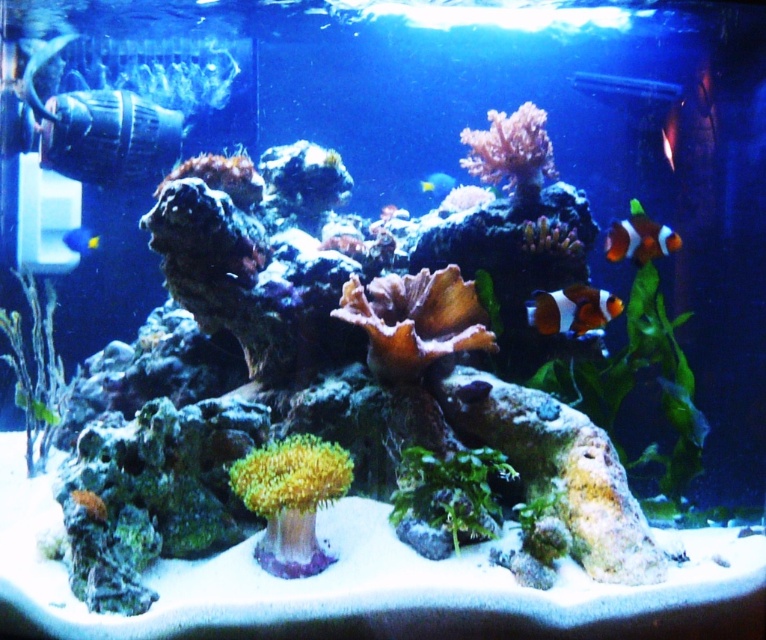
Does orange and white striped fish at upper right appear over translucent yellow fish at center?

Incorrect, orange and white striped fish at upper right is not positioned above translucent yellow fish at center.

Who is more distant from viewer, (x=630, y=246) or (x=434, y=182)?

The point (x=434, y=182) is behind.

Locate an element on the screen. This screenshot has width=766, height=640. orange and white striped fish at upper right is located at coordinates (640, 240).

At what (x,y) coordinates should I click in order to perform the action: click on orange and white striped fish at upper right. Please return your answer as a coordinate pair (x, y). Image resolution: width=766 pixels, height=640 pixels. Looking at the image, I should click on (640, 240).

Which is below, black and white striped fish at center or orange clownfish at upper right?

Positioned lower is black and white striped fish at center.

What do you see at coordinates (571, 308) in the screenshot? I see `black and white striped fish at center` at bounding box center [571, 308].

Is point (604, 296) more distant than point (614, 93)?

No.

Locate an element on the screen. The image size is (766, 640). black and white striped fish at center is located at coordinates (571, 308).

Does orange and white striped fish at upper right lie in front of blue glossy fish at left?

Yes, it is in front of blue glossy fish at left.

Which is behind, point (619, 228) or point (80, 250)?

Positioned behind is point (80, 250).

Locate an element on the screen. The height and width of the screenshot is (640, 766). orange and white striped fish at upper right is located at coordinates (640, 240).